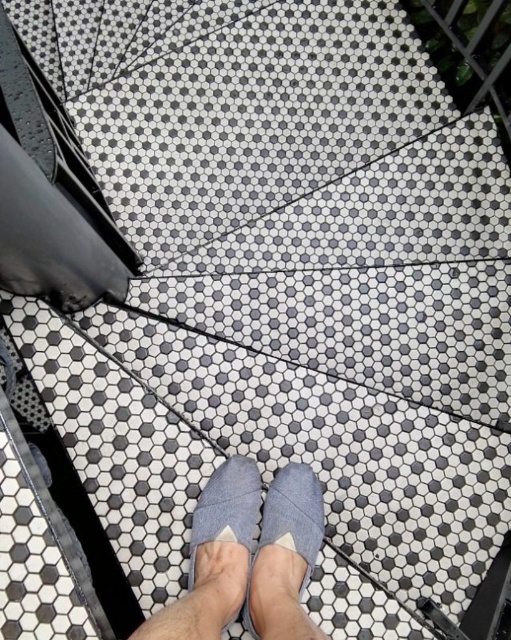
Question: Can you confirm if gray fabric slipper at center is bigger than gray fabric shoe at center?

Choices:
 (A) yes
 (B) no

Answer: (A)

Question: Is the position of gray fabric slipper at center more distant than that of gray fabric shoe at center?

Choices:
 (A) yes
 (B) no

Answer: (B)

Question: Which object appears farthest from the camera in this image?

Choices:
 (A) gray fabric shoe at center
 (B) gray fabric slipper at center

Answer: (A)

Question: Among these points, which one is farthest from the camera?

Choices:
 (A) (235, 460)
 (B) (306, 634)

Answer: (A)

Question: Is gray fabric slipper at center behind gray fabric shoe at center?

Choices:
 (A) yes
 (B) no

Answer: (B)